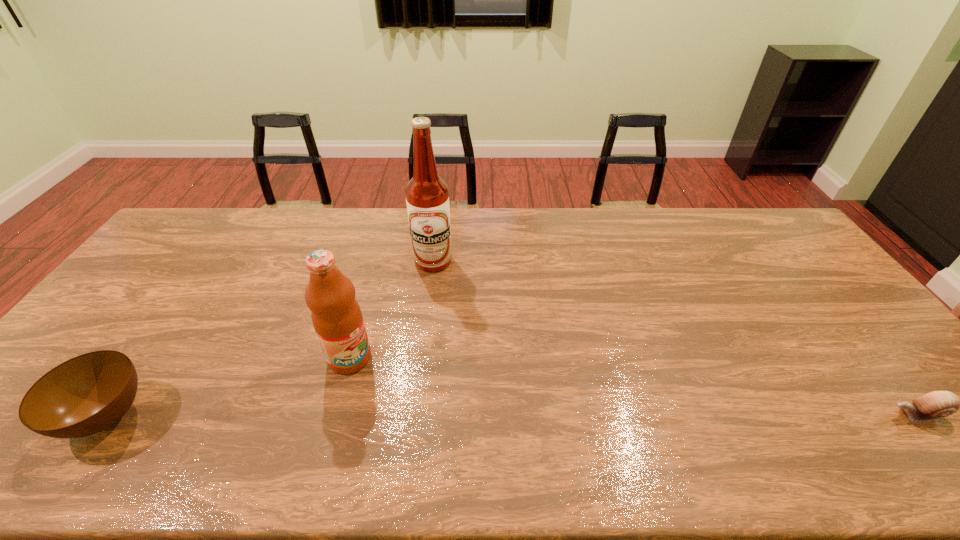
Locate an element on the screen. The height and width of the screenshot is (540, 960). bowl is located at coordinates (82, 396).

The height and width of the screenshot is (540, 960). What are the coordinates of `the second shortest object` in the screenshot? It's located at (82, 396).

Where is `escargot`? escargot is located at coordinates (936, 404).

Locate an element on the screen. The width and height of the screenshot is (960, 540). the shortest object is located at coordinates (936, 404).

At what (x,y) coordinates should I click in order to perform the action: click on the farthest object. Please return your answer as a coordinate pair (x, y). Looking at the image, I should click on (427, 197).

The image size is (960, 540). What are the coordinates of `the third object from left to right` in the screenshot? It's located at (427, 197).

Locate an element on the screen. This screenshot has width=960, height=540. fruit juice is located at coordinates (336, 315).

Where is `the third object from right to left`? The image size is (960, 540). the third object from right to left is located at coordinates (336, 315).

Locate an element on the screen. vacant space located 0.100m on the back of the bowl is located at coordinates (154, 348).

Where is `vacant space situated 0.220m on the front-facing side of the shortest object`? This screenshot has width=960, height=540. vacant space situated 0.220m on the front-facing side of the shortest object is located at coordinates (795, 414).